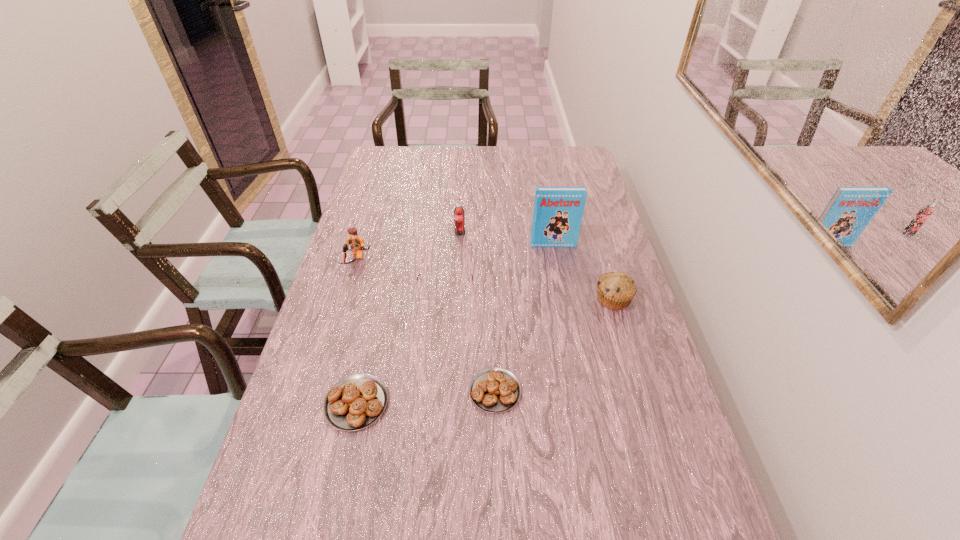
This screenshot has height=540, width=960. What are the coordinates of `blank space at the far right corner of the desktop` in the screenshot? It's located at (551, 152).

Where is `blank region between the third shortest object and the soda bottle`? blank region between the third shortest object and the soda bottle is located at coordinates (452, 265).

Find the location of a particular element. vacant area that lies between the right pastry and the left pastry is located at coordinates (425, 397).

I want to click on empty space that is in between the shortest object and the tallest object, so click(524, 318).

This screenshot has width=960, height=540. Identify the location of empty location between the right pastry and the spectacles. (469, 343).

You are a GUI agent. You are given a task and a screenshot of the screen. Output one action in this format:
    pyautogui.click(x=<x>, y=<y>)
    Task: Click on the unoccupied position between the third tallest object and the sixth tallest object
    
    Given the screenshot: What is the action you would take?
    pyautogui.click(x=355, y=332)

Where is `free area in between the fifth nearest object and the right pastry`? free area in between the fifth nearest object and the right pastry is located at coordinates (424, 326).

The height and width of the screenshot is (540, 960). Identify the location of empty location between the spectacles and the fifth shortest object. (399, 278).

The image size is (960, 540). I want to click on unoccupied position between the Lego and the sixth shortest object, so click(407, 247).

The width and height of the screenshot is (960, 540). Identify the location of vacant space that is in between the soda bottle and the spectacles. [x=452, y=265].